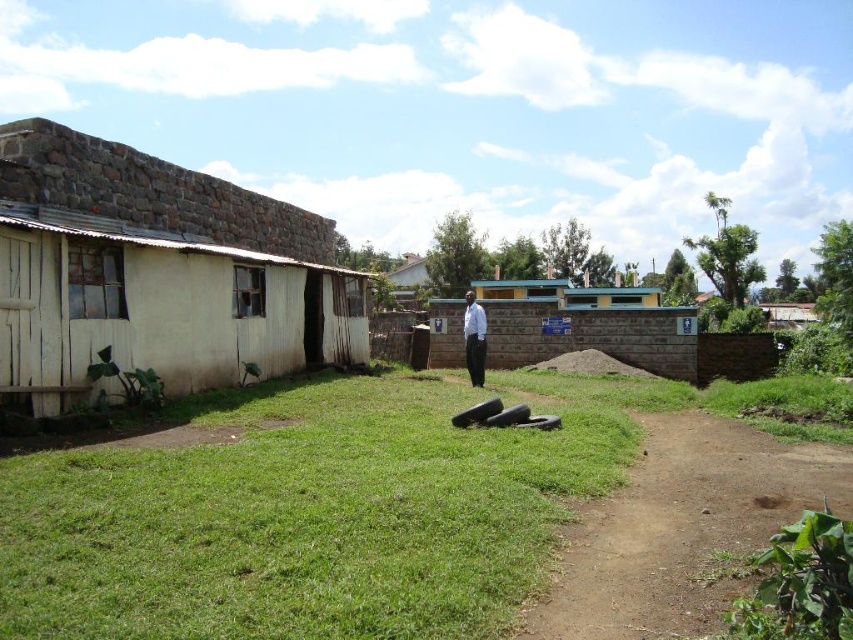
Question: Does green grass at center come behind white shirt at center?

Choices:
 (A) no
 (B) yes

Answer: (A)

Question: Which point appears closest to the camera in this image?

Choices:
 (A) (485, 342)
 (B) (248, 621)
 (C) (328, 364)
 (D) (457, 365)

Answer: (B)

Question: Which of the following is the farthest from the observer?

Choices:
 (A) green grass at center
 (B) white shirt at center
 (C) green concrete toilet at center

Answer: (C)

Question: From the image, what is the correct spatial relationship of green concrete toilet at center in relation to white shirt at center?

Choices:
 (A) left
 (B) right

Answer: (B)

Question: Which object is closer to the camera taking this photo?

Choices:
 (A) green concrete toilet at center
 (B) white stone hut at left
 (C) white shirt at center
 (D) green grass at center

Answer: (D)

Question: Does green grass at center have a lesser width compared to white stone hut at left?

Choices:
 (A) no
 (B) yes

Answer: (A)